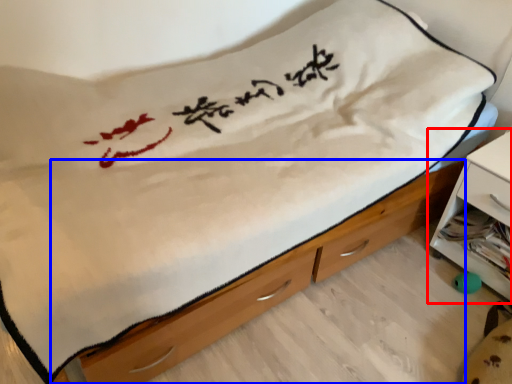
Question: Which object is closer to the camera taking this photo, nightstand (highlighted by a red box) or chest of drawers (highlighted by a blue box)?

Choices:
 (A) nightstand
 (B) chest of drawers

Answer: (B)